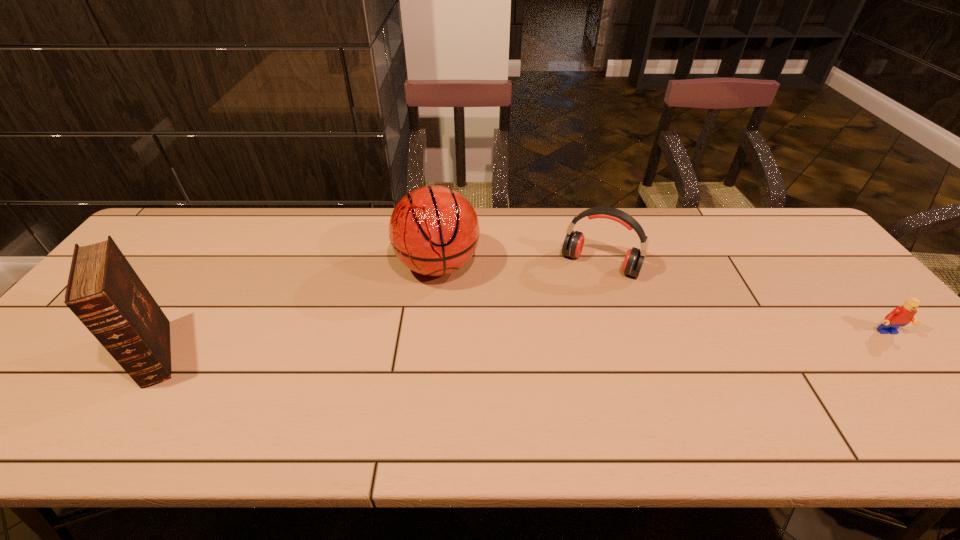
This screenshot has width=960, height=540. Find the location of `free point between the basketball and the earphone`. free point between the basketball and the earphone is located at coordinates (519, 265).

The image size is (960, 540). I want to click on vacant point located between the third object from right to left and the third tallest object, so click(519, 265).

I want to click on unoccupied area between the third object from left to right and the rightmost object, so click(x=743, y=299).

Locate an element on the screen. Image resolution: width=960 pixels, height=540 pixels. free spot between the Lego and the second shortest object is located at coordinates (743, 299).

The height and width of the screenshot is (540, 960). What are the coordinates of `the closest object to the Bible` in the screenshot? It's located at (434, 230).

Identify the location of object that is the third closest to the third object from right to left. Image resolution: width=960 pixels, height=540 pixels. (902, 315).

Identify the location of vacant space that satisfies the following two spatial constraints: 1. on the back side of the Bible; 2. on the left side of the third tallest object. Image resolution: width=960 pixels, height=540 pixels. (216, 264).